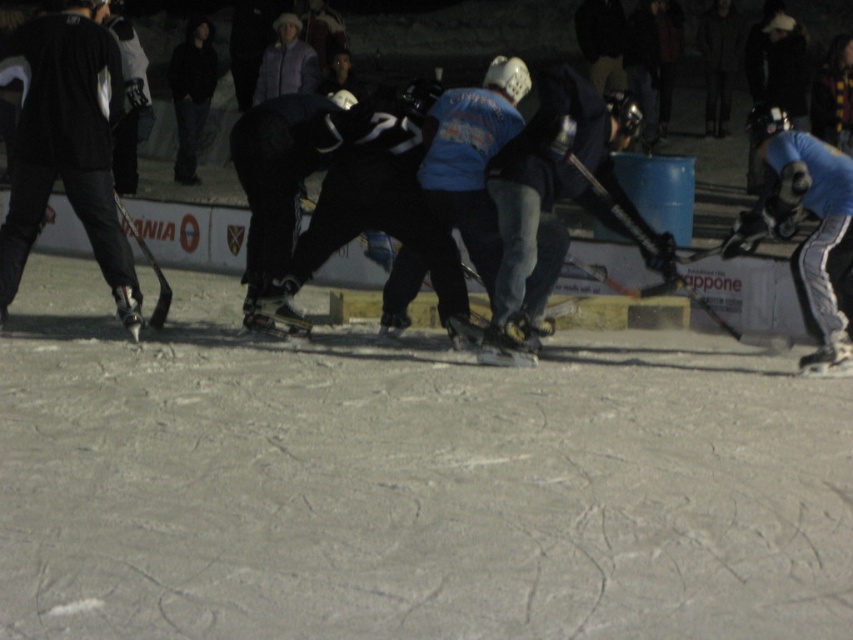
Question: Based on their relative distances, which object is farther from the wooden hockey stick at center?

Choices:
 (A) shiny black hockey stick at right
 (B) shiny black hockey stick at left
 (C) black matte skateboard at center

Answer: (B)

Question: Can you confirm if black matte skateboard at center is positioned to the right of shiny black hockey stick at right?

Choices:
 (A) yes
 (B) no

Answer: (B)

Question: Which point is farther to the camera?

Choices:
 (A) blue matte hockey stick at right
 (B) shiny black hockey stick at left

Answer: (B)

Question: Which of the following is the closest to the observer?

Choices:
 (A) (358, 141)
 (B) (126, 228)

Answer: (A)

Question: Is blue matte hockey stick at right bigger than shiny black hockey stick at right?

Choices:
 (A) yes
 (B) no

Answer: (B)

Question: Is wooden hockey stick at center smaller than shiny black hockey stick at right?

Choices:
 (A) no
 (B) yes

Answer: (B)